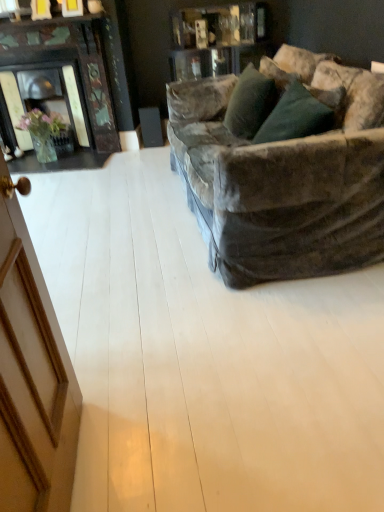
Question: Based on their sizes in the image, would you say light wood floor at center is bigger or smaller than velvet green pillow at upper right?

Choices:
 (A) big
 (B) small

Answer: (A)

Question: In the image, is light wood floor at center positioned in front of or behind velvet green pillow at upper right?

Choices:
 (A) behind
 (B) front

Answer: (B)

Question: Is point (115, 409) positioned closer to the camera than point (233, 95)?

Choices:
 (A) farther
 (B) closer

Answer: (B)

Question: Visually, is velvet green pillow at upper right positioned to the left or to the right of light wood floor at center?

Choices:
 (A) left
 (B) right

Answer: (B)

Question: From the image's perspective, relative to light wood floor at center, is velvet green pillow at upper right above or below?

Choices:
 (A) above
 (B) below

Answer: (A)

Question: Is velvet green pillow at upper right in front of or behind light wood floor at center in the image?

Choices:
 (A) behind
 (B) front

Answer: (A)

Question: Does point (249, 95) appear closer or farther from the camera than point (372, 462)?

Choices:
 (A) closer
 (B) farther

Answer: (B)